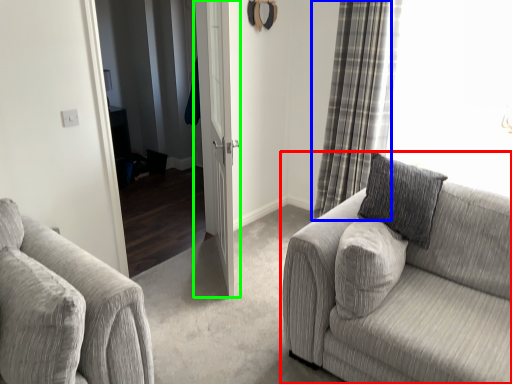
Question: Estimate the real-world distances between objects in this image. Which object is farther from studio couch (highlighted by a red box), curtain (highlighted by a blue box) or door (highlighted by a green box)?

Choices:
 (A) curtain
 (B) door

Answer: (A)